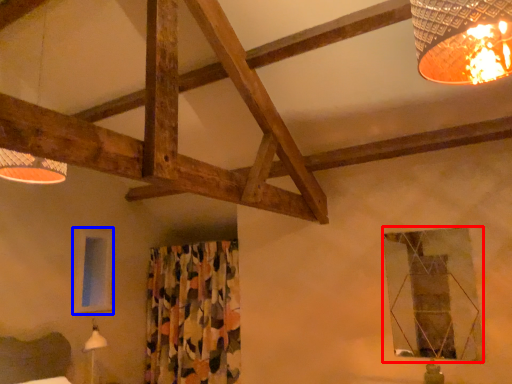
Question: Which object appears farthest to the camera in this image, window (highlighted by a red box) or window (highlighted by a blue box)?

Choices:
 (A) window
 (B) window

Answer: (B)